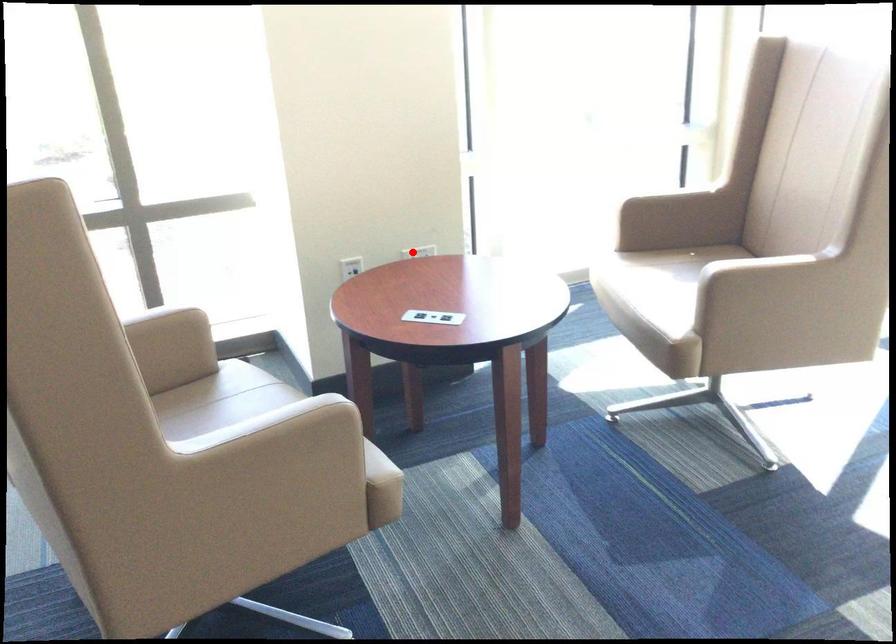
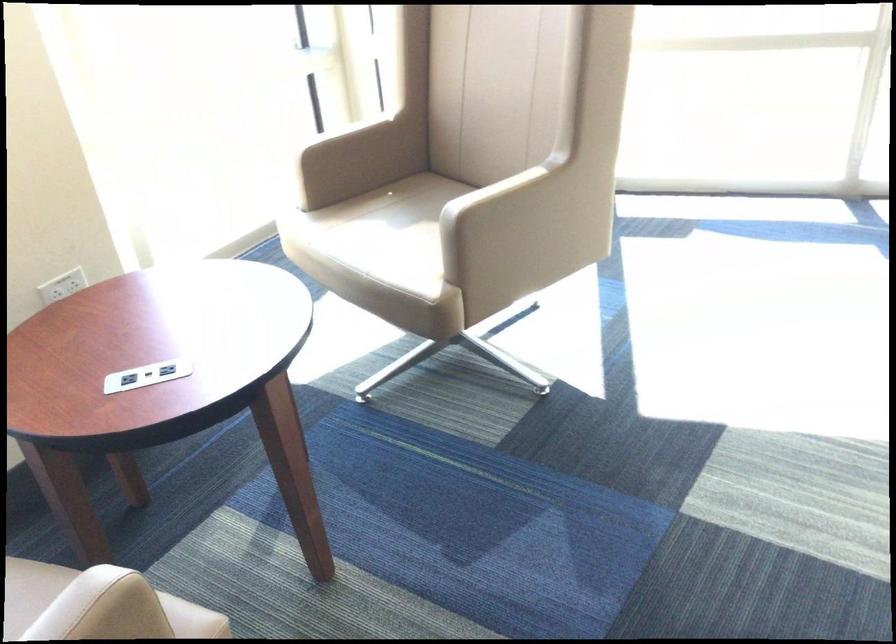
Question: I am providing you with two images of the same scene from different viewpoints. A red point is shown in image1. For the corresponding object point in image2, is it positioned nearer or farther from the camera?

Choices:
 (A) Nearer
 (B) Farther

Answer: (A)